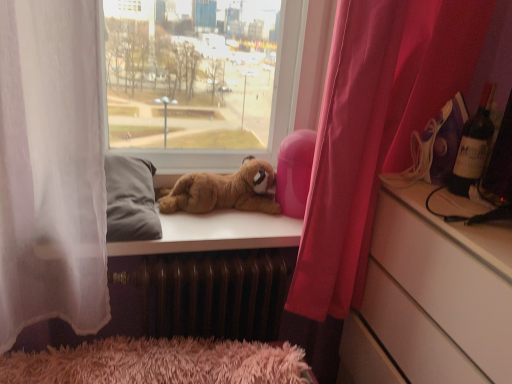
Question: Considering the positions of point (x=304, y=289) and point (x=458, y=173), is point (x=304, y=289) closer or farther from the camera than point (x=458, y=173)?

Choices:
 (A) farther
 (B) closer

Answer: (A)

Question: Considering their positions, is pink fabric curtain at right located in front of or behind dark red glass wine bottle at upper right?

Choices:
 (A) behind
 (B) front

Answer: (B)

Question: Which of these objects is positioned farthest from the brown metallic radiator at lower center?

Choices:
 (A) pink fabric curtain at right
 (B) dark red glass wine bottle at upper right
 (C) soft brown plush dog at center
 (D) white glossy cabinet at right

Answer: (B)

Question: Which is nearer to the pink fabric curtain at right?

Choices:
 (A) soft brown plush dog at center
 (B) brown metallic radiator at lower center
 (C) white glossy cabinet at right
 (D) dark red glass wine bottle at upper right

Answer: (C)